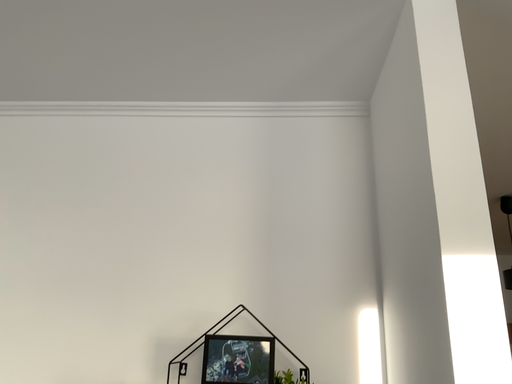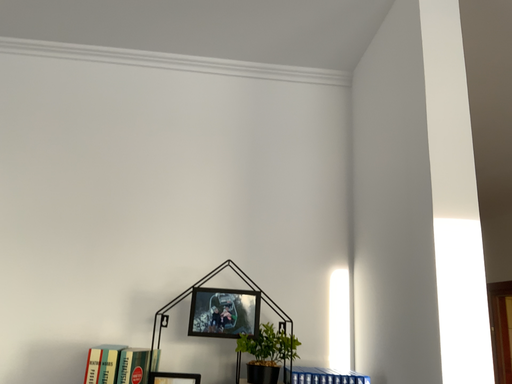
Question: Which way did the camera rotate in the video?

Choices:
 (A) rotated right
 (B) rotated left

Answer: (A)